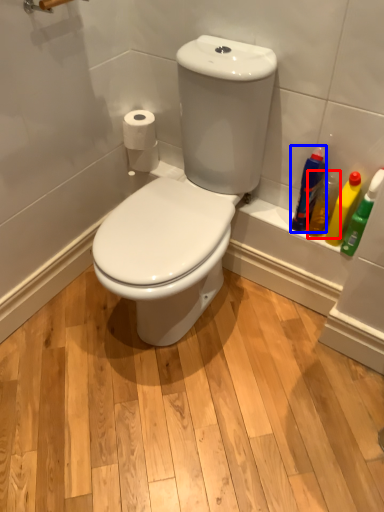
Question: Among these objects, which one is nearest to the camera, cleaning product (highlighted by a red box) or cleaning product (highlighted by a blue box)?

Choices:
 (A) cleaning product
 (B) cleaning product

Answer: (B)